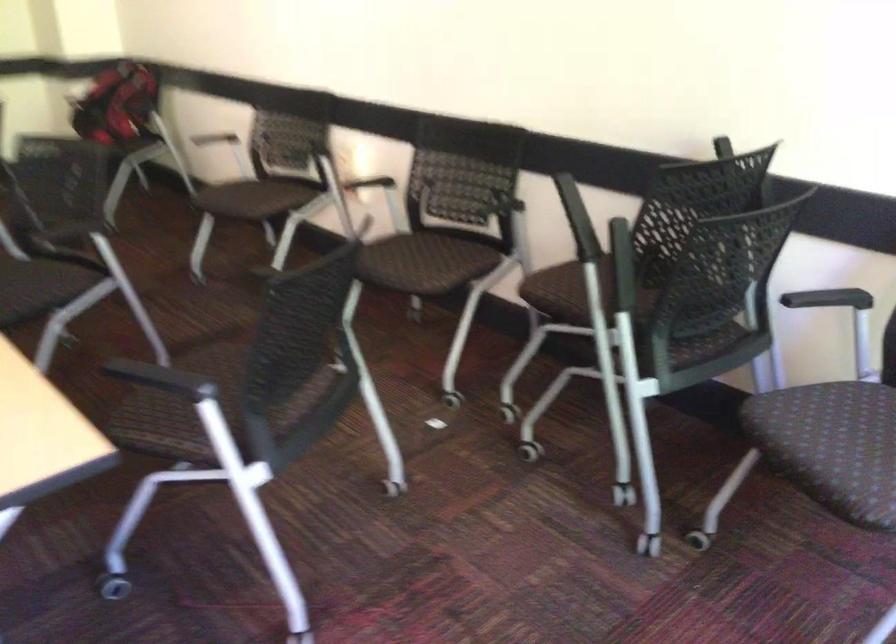
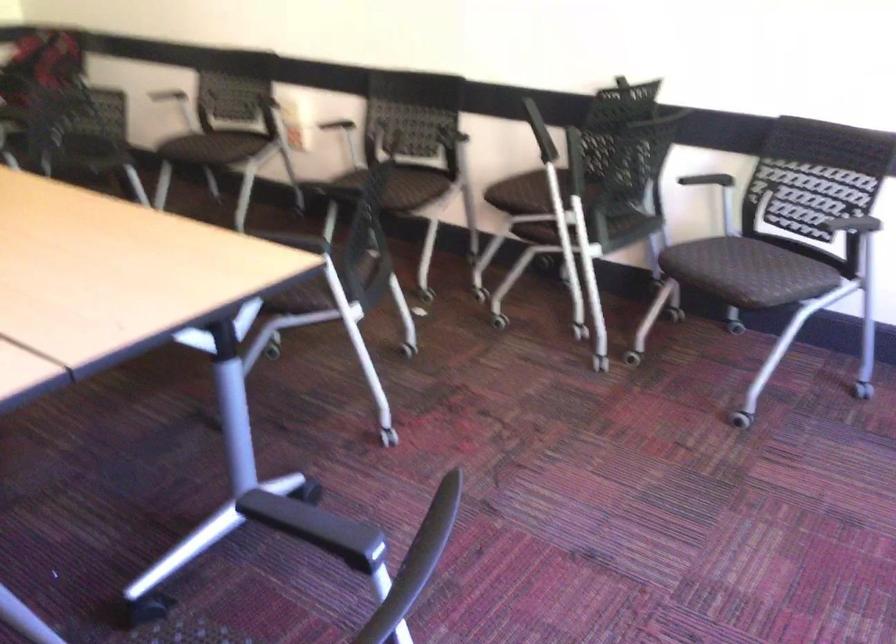
Locate, in the second image, the point that corresponds to point 570,296 in the first image.

(526, 193)